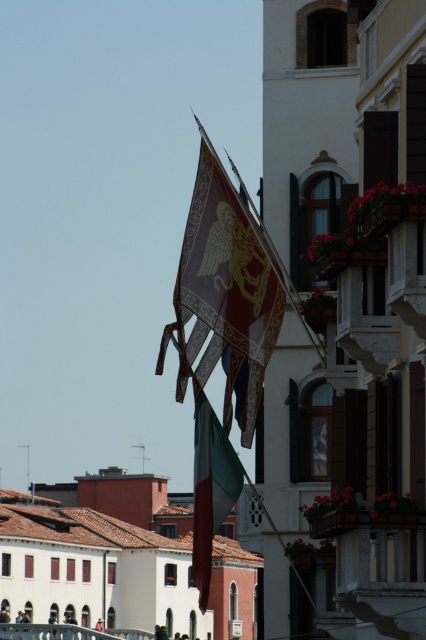
From the picture: Does metallic gold flag at center appear over green-white-red fabric flag at center?

Correct, metallic gold flag at center is located above green-white-red fabric flag at center.

This screenshot has height=640, width=426. Describe the element at coordinates (224, 298) in the screenshot. I see `metallic gold flag at center` at that location.

Does point (232, 257) come behind point (207, 596)?

That is False.

In order to click on metallic gold flag at center in this screenshot , I will do `click(224, 298)`.